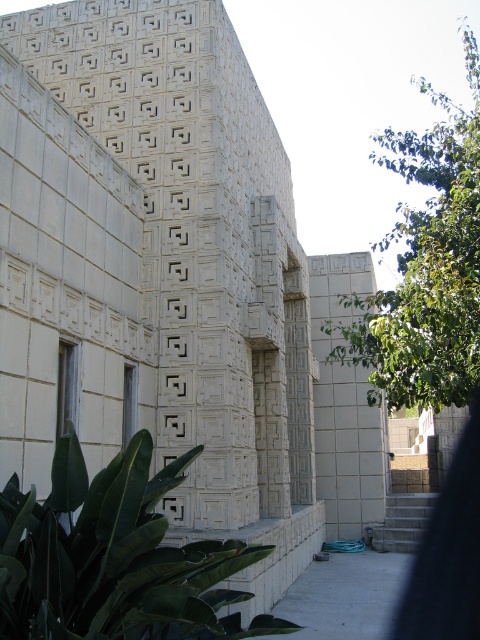
Question: Is green leafy plant at lower left below green leafy plant at right?

Choices:
 (A) yes
 (B) no

Answer: (A)

Question: Is green leafy plant at lower left to the right of green leafy plant at right from the viewer's perspective?

Choices:
 (A) no
 (B) yes

Answer: (A)

Question: Does green leafy plant at lower left appear under green leafy plant at right?

Choices:
 (A) no
 (B) yes

Answer: (B)

Question: Among these objects, which one is farthest from the camera?

Choices:
 (A) green leafy plant at right
 (B) green leafy plant at lower left

Answer: (A)

Question: Which point is closer to the camera?

Choices:
 (A) green leafy plant at right
 (B) green leafy plant at lower left

Answer: (B)

Question: Which point appears closest to the camera in this image?

Choices:
 (A) (423, 381)
 (B) (3, 513)

Answer: (B)